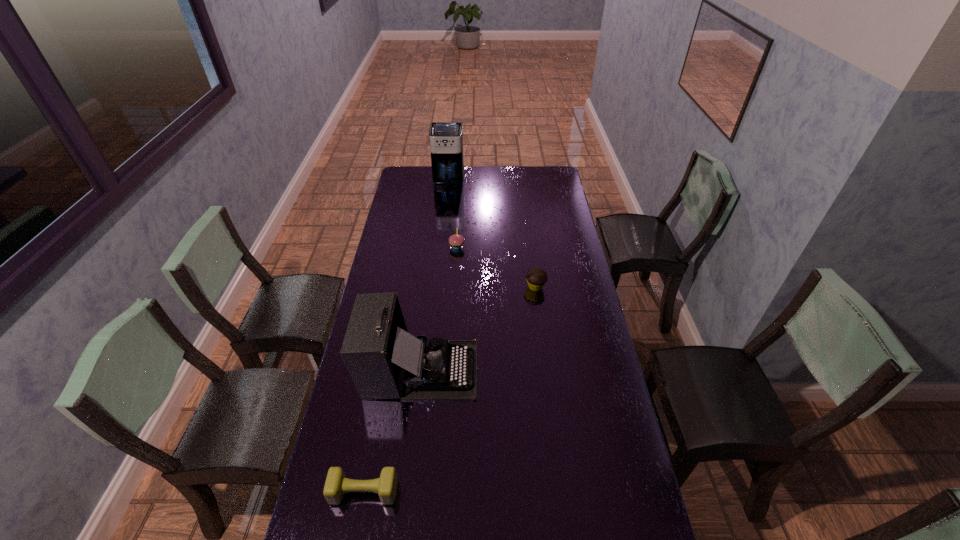
Where is `free space located 0.330m on the back of the muffin`? The image size is (960, 540). free space located 0.330m on the back of the muffin is located at coordinates (528, 231).

Identify the location of vacant space situated on the right of the nearest object. (437, 491).

Where is `object at the far edge`? object at the far edge is located at coordinates (446, 138).

Where is `typewriter at the left edge`? typewriter at the left edge is located at coordinates (384, 361).

Identify the location of dumbbell at the left edge. The image size is (960, 540). (336, 485).

Image resolution: width=960 pixels, height=540 pixels. In the image, there is a desktop. Identify the location of free region at the far edge. (481, 178).

Where is `vacant region at the left edge`? vacant region at the left edge is located at coordinates (408, 202).

At what (x,y) coordinates should I click in order to perform the action: click on vacant area at the right edge of the desktop. Please return your answer as a coordinate pair (x, y). The width and height of the screenshot is (960, 540). Looking at the image, I should click on (608, 386).

You are a GUI agent. You are given a task and a screenshot of the screen. Output one action in this format:
    pyautogui.click(x=<x>, y=<y>)
    Task: Click on the free space at the far right corner of the desktop
    The width and height of the screenshot is (960, 540).
    Given the screenshot: What is the action you would take?
    pyautogui.click(x=554, y=183)

The width and height of the screenshot is (960, 540). What are the coordinates of `free space between the farthest object and the typewriter` in the screenshot? It's located at (435, 275).